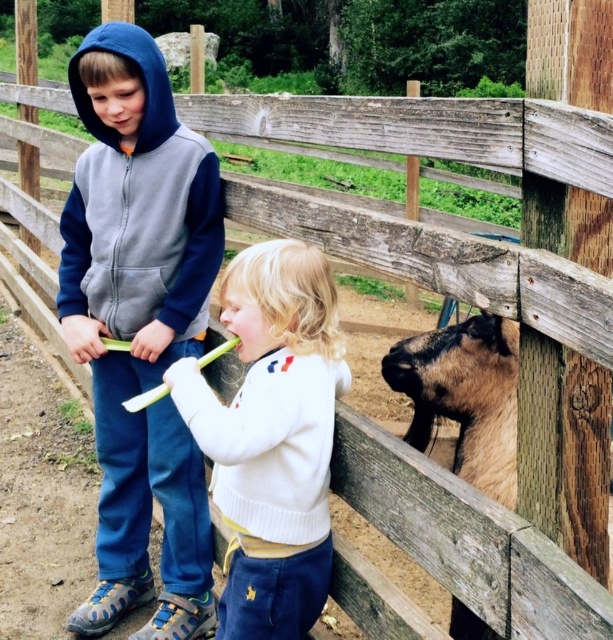
You are a parent trying to ensure your child stays safe while feeding the goat. The navy blue fleece hoodie at center and the brown fuzzy goat at right are in the scene. Which one is positioned higher?

The navy blue fleece hoodie at center is above the brown fuzzy goat at right, so the hoodie is positioned higher.

You are a photographer trying to capture a photo of the white soft sweater at center and the brown fuzzy goat at right. Based on their heights, which one should you focus on first to ensure both are in frame?

The white soft sweater at center is taller than the brown fuzzy goat at right, so you should focus on the white soft sweater at center first to ensure both are in frame.

You are a photographer trying to capture a group photo of the white soft sweater at center and the brown fuzzy goat at right. Based on their sizes, which one should you position closer to the camera to ensure both appear equally sized in the photo?

The white soft sweater at center might be wider than the brown fuzzy goat at right, so you should position the brown fuzzy goat at right closer to the camera to balance their sizes in the photo.